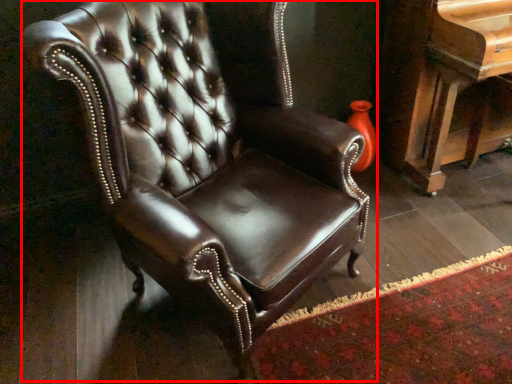
Question: From the image, what is the correct spatial relationship of chair (annotated by the red box) in relation to piano?

Choices:
 (A) right
 (B) left

Answer: (B)